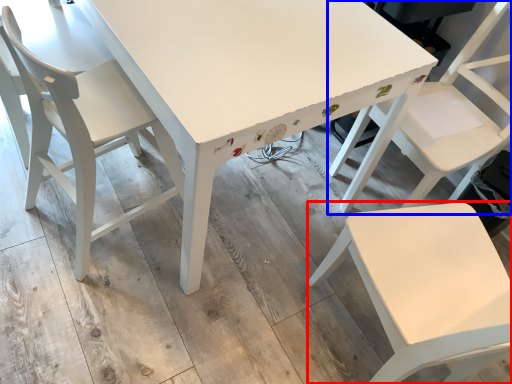
Question: Which point is further to the camera, chair (highlighted by a red box) or chair (highlighted by a blue box)?

Choices:
 (A) chair
 (B) chair

Answer: (B)